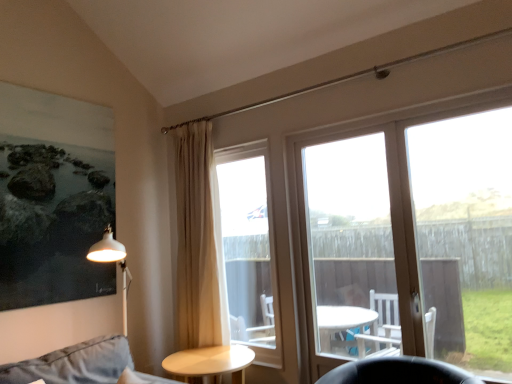
You are a GUI agent. You are given a task and a screenshot of the screen. Output one action in this format:
    pyautogui.click(x=<x>, y=<y>)
    Task: Click on the vacant space situated above transparent glass door at upper right (from a real-world perspective)
    The image size is (512, 384).
    Given the screenshot: What is the action you would take?
    pyautogui.click(x=398, y=108)